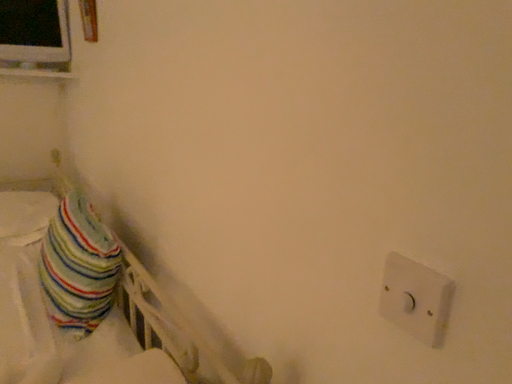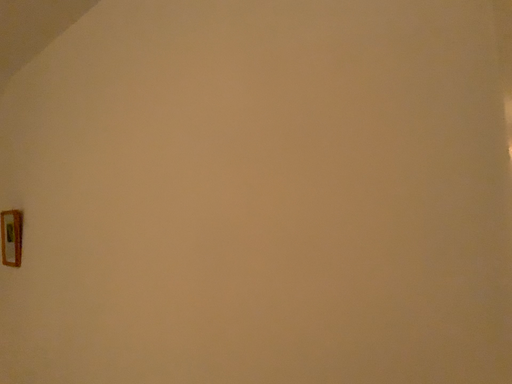
Question: Which way did the camera rotate in the video?

Choices:
 (A) rotated upward
 (B) rotated downward

Answer: (A)